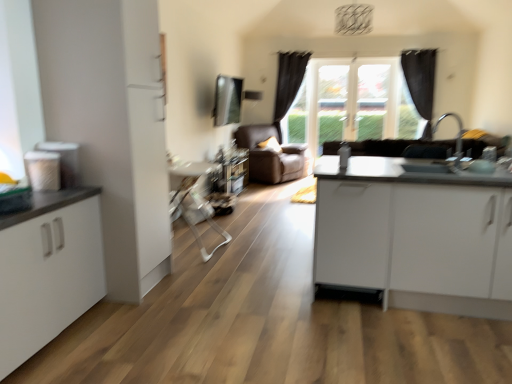
Question: From a real-world perspective, is matte brown leather couch at center on top of black fabric curtain at upper right, which appears as the 1th curtain when viewed from the right?

Choices:
 (A) yes
 (B) no

Answer: (B)

Question: Is matte brown leather couch at center thinner than black fabric curtain at upper right, which appears as the 2th curtain when viewed from the left?

Choices:
 (A) no
 (B) yes

Answer: (A)

Question: Can you confirm if matte brown leather couch at center is wider than black fabric curtain at upper right, which appears as the 2th curtain when viewed from the left?

Choices:
 (A) no
 (B) yes

Answer: (B)

Question: Considering the relative positions of matte brown leather couch at center and black fabric curtain at upper right, which appears as the 2th curtain when viewed from the left, in the image provided, is matte brown leather couch at center in front of black fabric curtain at upper right, which appears as the 2th curtain when viewed from the left,?

Choices:
 (A) no
 (B) yes

Answer: (B)

Question: Can you confirm if matte brown leather couch at center is bigger than black fabric curtain at upper right, which appears as the 1th curtain when viewed from the right?

Choices:
 (A) no
 (B) yes

Answer: (B)

Question: From the image's perspective, would you say matte brown leather couch at center is positioned over black fabric curtain at upper right, which appears as the 2th curtain when viewed from the left?

Choices:
 (A) no
 (B) yes

Answer: (A)

Question: Is black fabric curtain at upper right, which appears as the 1th curtain when viewed from the right, to the left of matte brown leather couch at center from the viewer's perspective?

Choices:
 (A) no
 (B) yes

Answer: (A)

Question: From a real-world perspective, is black fabric curtain at upper right, which appears as the 2th curtain when viewed from the left, located higher than matte brown leather couch at center?

Choices:
 (A) no
 (B) yes

Answer: (B)

Question: From a real-world perspective, is black fabric curtain at upper right, which appears as the 2th curtain when viewed from the left, under matte brown leather couch at center?

Choices:
 (A) yes
 (B) no

Answer: (B)

Question: Is black fabric curtain at upper right, which appears as the 1th curtain when viewed from the right, thinner than matte brown leather couch at center?

Choices:
 (A) no
 (B) yes

Answer: (B)

Question: Is the position of black fabric curtain at upper right, which appears as the 2th curtain when viewed from the left, less distant than that of matte brown leather couch at center?

Choices:
 (A) yes
 (B) no

Answer: (B)

Question: Does black fabric curtain at upper right, which appears as the 2th curtain when viewed from the left, have a lesser height compared to matte brown leather couch at center?

Choices:
 (A) no
 (B) yes

Answer: (A)

Question: Is black fabric curtain at center, the second curtain when ordered from right to left, at the back of black fabric curtain at upper right, which appears as the 2th curtain when viewed from the left?

Choices:
 (A) no
 (B) yes

Answer: (A)